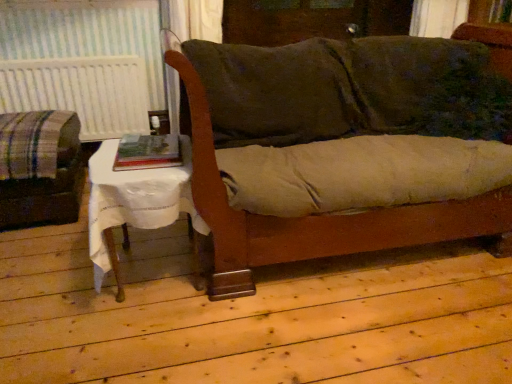
You are a GUI agent. You are given a task and a screenshot of the screen. Output one action in this format:
    pyautogui.click(x=<x>, y=<y>)
    Task: Click on the vacant space situated above white cloth-covered table at lower left (from a real-world perspective)
    The image size is (512, 384).
    Given the screenshot: What is the action you would take?
    pyautogui.click(x=130, y=157)